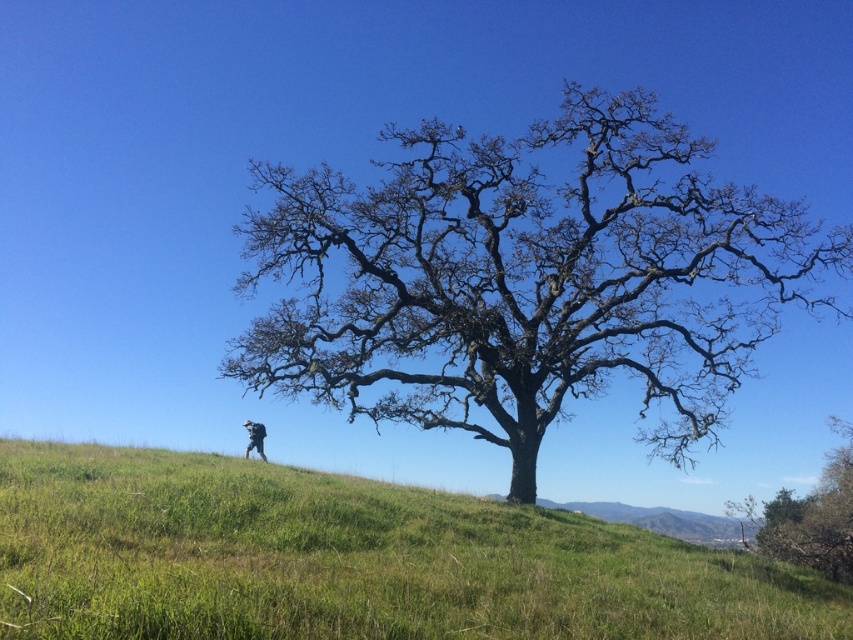
Question: Observing the image, what is the correct spatial positioning of bare branches at center in reference to camouflage fabric jacket at lower center?

Choices:
 (A) left
 (B) right

Answer: (B)

Question: Which of the following is the closest to the observer?

Choices:
 (A) green grassy hillside at center
 (B) bare branches at center
 (C) camouflage fabric jacket at lower center

Answer: (A)

Question: Estimate the real-world distances between objects in this image. Which object is farther from the green grassy hillside at center?

Choices:
 (A) bare branches at center
 (B) camouflage fabric jacket at lower center

Answer: (B)

Question: From the image, what is the correct spatial relationship of bare branches at center in relation to camouflage fabric jacket at lower center?

Choices:
 (A) below
 (B) above

Answer: (B)

Question: Is bare branches at center to the left of camouflage fabric jacket at lower center from the viewer's perspective?

Choices:
 (A) yes
 (B) no

Answer: (B)

Question: Which object appears closest to the camera in this image?

Choices:
 (A) smooth bark tree at right
 (B) camouflage fabric jacket at lower center
 (C) bare branches at center
 (D) green grassy hillside at center

Answer: (D)